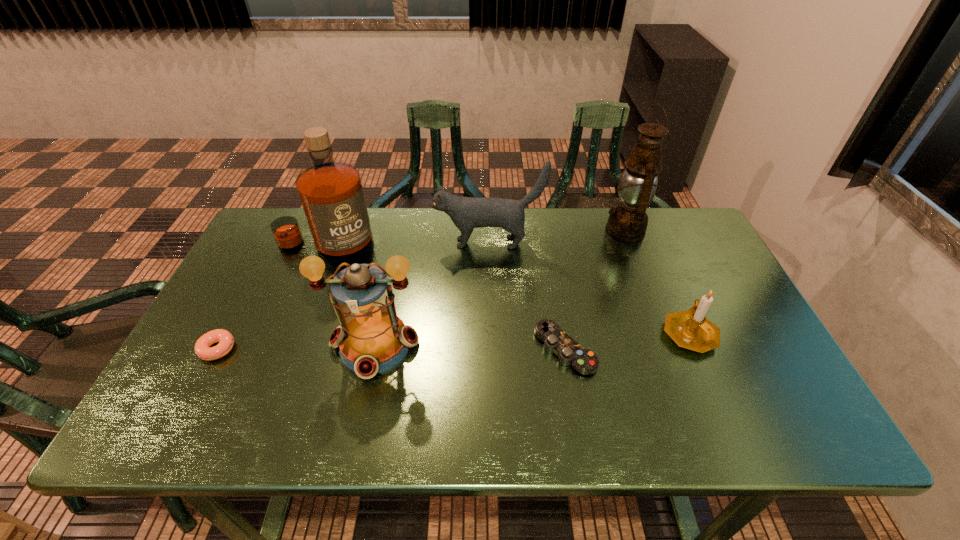
Locate an element on the screen. The width and height of the screenshot is (960, 540). free space that satisfies the following two spatial constraints: 1. on the back side of the doughnut; 2. on the right side of the oil lamp is located at coordinates (279, 231).

Find the location of `free location that satisfies the following two spatial constraints: 1. at the face of the cat; 2. on the left side of the control`. free location that satisfies the following two spatial constraints: 1. at the face of the cat; 2. on the left side of the control is located at coordinates (491, 349).